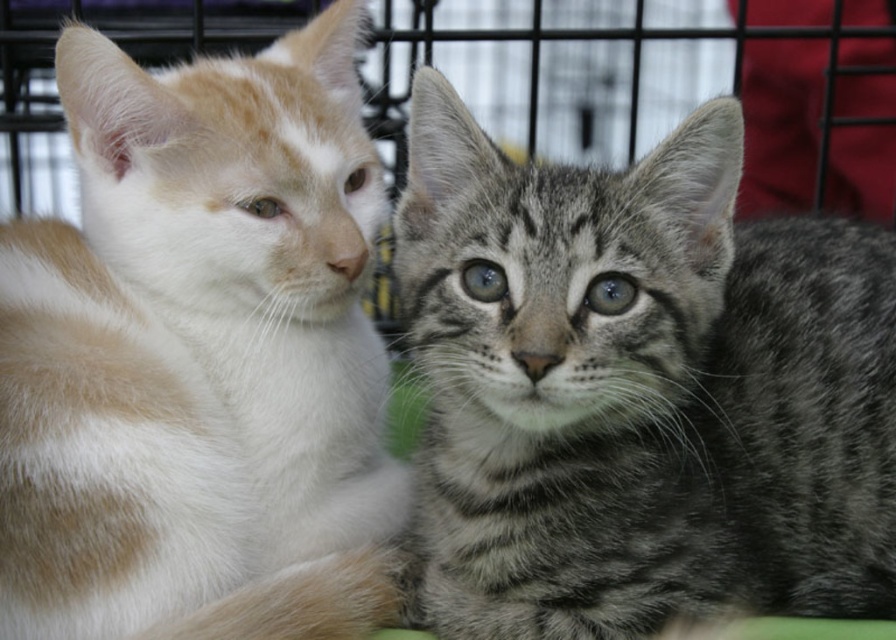
You are a photographer trying to capture a closeup of the gray striped kitten at center. The camera is currently focused at point 0.5, 0.5. Do you need to adjust the focus point to the right or left to get the kitten in focus?

The gray striped kitten at center is located at point (639, 388). Since the current focus point is at (448, 320), you need to move the focus point to the right and upward to align with the kitten.

You are a photographer trying to capture a clear photo of both the gray striped kitten at center and the white fur cat at left. Since you want both to be in focus, you need to adjust your camera settings. Which kitten is closer to you?

The gray striped kitten at center is closer to you than the white fur cat at left, so you should focus on the gray striped kitten at center to ensure both are in focus.